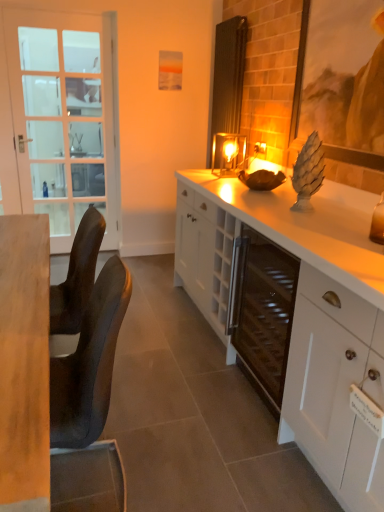
Find the location of a particular element. Image resolution: width=384 pixels, height=512 pixels. white glass screen door at left is located at coordinates (64, 119).

Describe the element at coordinates (64, 119) in the screenshot. I see `white glass screen door at left` at that location.

What are the coordinates of `white matte cabinet at lower right` in the screenshot? It's located at (335, 388).

Locate an element on the screen. The height and width of the screenshot is (512, 384). matte wooden picture frame at upper right is located at coordinates (342, 80).

In order to face matte wooden picture frame at upper right, should I rotate leftwards or rightwards?

Rotate right and turn 19.542 degrees.

The image size is (384, 512). Find the location of `white glass screen door at left`. white glass screen door at left is located at coordinates (64, 119).

Which object is further away from the camera taking this photo, matte wooden picture frame at upper right or light brown wood desk at left?

matte wooden picture frame at upper right is more distant.

Is matte wooden picture frame at upper right bigger than light brown wood desk at left?

Actually, matte wooden picture frame at upper right might be smaller than light brown wood desk at left.

Can you confirm if matte wooden picture frame at upper right is positioned to the left of light brown wood desk at left?

No, matte wooden picture frame at upper right is not to the left of light brown wood desk at left.

Is light brown wood desk at left not close to metallic glass candle holder at center?

light brown wood desk at left is positioned a significant distance from metallic glass candle holder at center.

Which object is positioned more to the left, light brown wood desk at left or metallic glass candle holder at center?

From the viewer's perspective, light brown wood desk at left appears more on the left side.

Which of these two, light brown wood desk at left or metallic glass candle holder at center, stands shorter?

With less height is metallic glass candle holder at center.

Which object is thinner, light brown wood desk at left or metallic glass candle holder at center?

metallic glass candle holder at center is thinner.

Would you say white glossy cabinet at center is part of light brown wood desk at left's contents?

That's incorrect, white glossy cabinet at center is not inside light brown wood desk at left.

What's the angular difference between light brown wood desk at left and white glossy cabinet at center's facing directions?

90.1 degrees.

Considering the sizes of objects light brown wood desk at left and white glossy cabinet at center in the image provided, who is taller, light brown wood desk at left or white glossy cabinet at center?

white glossy cabinet at center.

Measure the distance between light brown wood desk at left and white glossy cabinet at center.

A distance of 1.06 meters exists between light brown wood desk at left and white glossy cabinet at center.

Considering the positions of objects black leather chair at left and white glass screen door at left in the image provided, who is more to the left, black leather chair at left or white glass screen door at left?

From the viewer's perspective, white glass screen door at left appears more on the left side.

Is black leather chair at left touching white glass screen door at left?

They are not placed beside each other.

Considering the positions of points (112, 259) and (59, 185), is point (112, 259) farther from camera compared to point (59, 185)?

That is False.

Is black leather chair at left inside or outside of white glass screen door at left?

black leather chair at left lies outside white glass screen door at left.

Is white glass screen door at left facing away from white matte cabinet at lower right?

No.

Considering their positions, is white glass screen door at left located in front of or behind white matte cabinet at lower right?

Visually, white glass screen door at left is located behind white matte cabinet at lower right.

Does white glass screen door at left have a greater height compared to white matte cabinet at lower right?

Yes.

At what (x,y) coordinates should I click in order to perform the action: click on screen door above the white matte cabinet at lower right (from the image's perspective). Please return your answer as a coordinate pair (x, y). This screenshot has width=384, height=512. Looking at the image, I should click on point(64,119).

Are white matte cabinet at lower right and white glass screen door at left beside each other?

white matte cabinet at lower right and white glass screen door at left are clearly separated.

Find the location of `cabinetry below the white glass screen door at left (from a real-world perspective)`. cabinetry below the white glass screen door at left (from a real-world perspective) is located at coordinates (335, 388).

Choose the correct answer: Is white matte cabinet at lower right inside white glass screen door at left or outside it?

white matte cabinet at lower right lies outside white glass screen door at left.

Can you confirm if white glass screen door at left is shorter than white glossy cabinet at center?

No, white glass screen door at left is not shorter than white glossy cabinet at center.

What's the angular difference between white glass screen door at left and white glossy cabinet at center's facing directions?

The facing directions of white glass screen door at left and white glossy cabinet at center are 89.6 degrees apart.

Where is `countertop below the white glass screen door at left (from the image's perspective)`? Image resolution: width=384 pixels, height=512 pixels. countertop below the white glass screen door at left (from the image's perspective) is located at coordinates (308, 226).

Is white glossy cabinet at center a part of white glass screen door at left?

No, white glossy cabinet at center is not a part of white glass screen door at left.

Identify the location of desk to the left of matte wooden picture frame at upper right. click(24, 362).

Locate an element on the screen. The width and height of the screenshot is (384, 512). candle holder that appears above the light brown wood desk at left (from the image's perspective) is located at coordinates (228, 154).

In the scene shown: Based on their spatial positions, is white glossy cabinet at center or black leather chair at left closer to white matte cabinet at lower right?

white glossy cabinet at center.

Based on their spatial positions, is black leather chair at left or white matte cabinet at lower right closer to matte wooden picture frame at upper right?

white matte cabinet at lower right lies closer to matte wooden picture frame at upper right than the other object.

Considering their positions, is light brown wood desk at left positioned further to black leather chair at left than white glossy cabinet at center?

Among the two, white glossy cabinet at center is located further to black leather chair at left.

Estimate the real-world distances between objects in this image. Which object is further from metallic glass candle holder at center, white glass screen door at left or white matte cabinet at lower right?

white matte cabinet at lower right lies further to metallic glass candle holder at center than the other object.

Looking at this image, estimate the real-world distances between objects in this image. Which object is further from light brown wood desk at left, matte wooden picture frame at upper right or white glossy cabinet at center?

matte wooden picture frame at upper right is further to light brown wood desk at left.

Estimate the real-world distances between objects in this image. Which object is closer to white glass screen door at left, black leather chair at left or white matte cabinet at lower right?

The object closer to white glass screen door at left is black leather chair at left.

Based on their spatial positions, is white glass screen door at left or white matte cabinet at lower right closer to white glossy cabinet at center?

Based on the image, white matte cabinet at lower right appears to be nearer to white glossy cabinet at center.

Which object lies nearer to the anchor point white glossy cabinet at center, matte wooden picture frame at upper right or white matte cabinet at lower right?

Among the two, white matte cabinet at lower right is located nearer to white glossy cabinet at center.

I want to click on picture frame between black leather chair at left and white glass screen door at left from front to back, so click(x=342, y=80).

Find the location of a particular element. The height and width of the screenshot is (512, 384). countertop between matte wooden picture frame at upper right and metallic glass candle holder at center from front to back is located at coordinates (308, 226).

Locate an element on the screen. This screenshot has width=384, height=512. picture frame positioned between light brown wood desk at left and metallic glass candle holder at center from near to far is located at coordinates (342, 80).

The image size is (384, 512). In order to click on chair between light brown wood desk at left and white matte cabinet at lower right from left to right in this screenshot , I will do `click(89, 403)`.